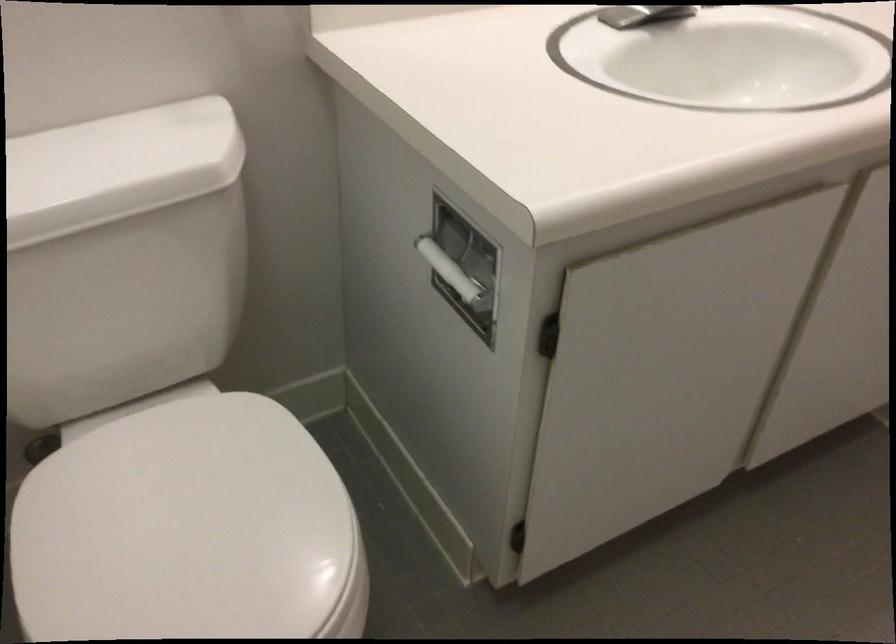
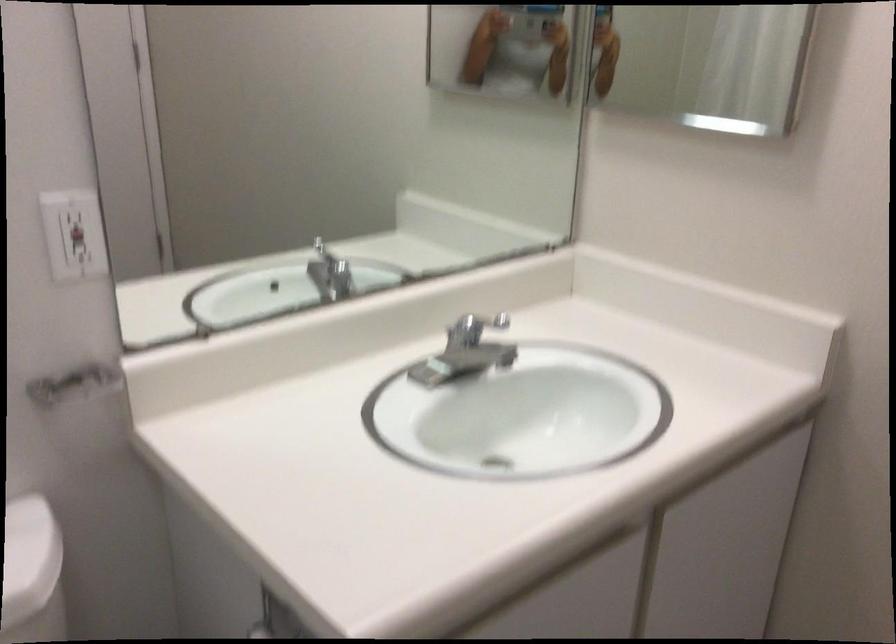
Question: The images are taken continuously from a first-person perspective. In which direction is your viewpoint rotating?

Choices:
 (A) Left
 (B) Right
 (C) Up
 (D) Down

Answer: (C)